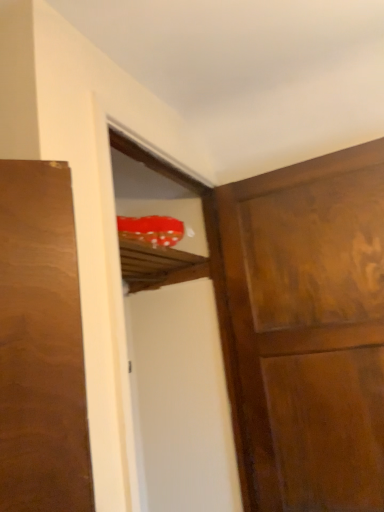
Question: Is transparent plastic screen door at upper center thinner than wooden door at upper right?

Choices:
 (A) yes
 (B) no

Answer: (B)

Question: Could you tell me if transparent plastic screen door at upper center is turned towards wooden door at upper right?

Choices:
 (A) yes
 (B) no

Answer: (A)

Question: Is transparent plastic screen door at upper center positioned before wooden door at upper right?

Choices:
 (A) yes
 (B) no

Answer: (A)

Question: Is wooden door at upper right surrounded by transparent plastic screen door at upper center?

Choices:
 (A) yes
 (B) no

Answer: (B)

Question: Is transparent plastic screen door at upper center wider than wooden door at upper right?

Choices:
 (A) no
 (B) yes

Answer: (B)

Question: Considering the relative sizes of transparent plastic screen door at upper center and wooden door at upper right in the image provided, is transparent plastic screen door at upper center bigger than wooden door at upper right?

Choices:
 (A) no
 (B) yes

Answer: (B)

Question: Is wooden door at upper right directly adjacent to transparent plastic screen door at upper center?

Choices:
 (A) no
 (B) yes

Answer: (A)

Question: Is wooden door at upper right smaller than transparent plastic screen door at upper center?

Choices:
 (A) no
 (B) yes

Answer: (B)

Question: Is wooden door at upper right wider than transparent plastic screen door at upper center?

Choices:
 (A) no
 (B) yes

Answer: (A)

Question: Does wooden door at upper right have a lesser width compared to transparent plastic screen door at upper center?

Choices:
 (A) no
 (B) yes

Answer: (B)

Question: Does wooden door at upper right lie in front of transparent plastic screen door at upper center?

Choices:
 (A) yes
 (B) no

Answer: (B)

Question: Is transparent plastic screen door at upper center inside wooden door at upper right?

Choices:
 (A) no
 (B) yes

Answer: (A)

Question: Visually, is transparent plastic screen door at upper center positioned to the left or to the right of wooden door at upper right?

Choices:
 (A) left
 (B) right

Answer: (A)